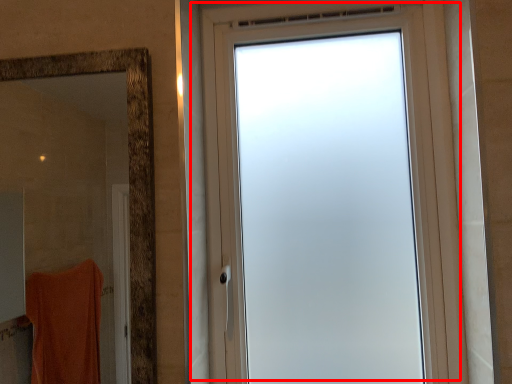
Question: From the image's perspective, where is window (annotated by the red box) located relative to mirror?

Choices:
 (A) above
 (B) below

Answer: (A)